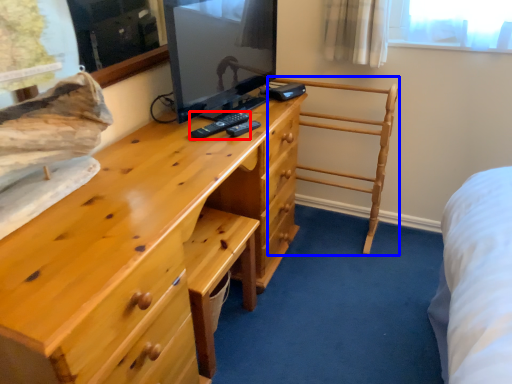
Question: Among these objects, which one is nearest to the camera, remote (highlighted by a red box) or furniture (highlighted by a blue box)?

Choices:
 (A) remote
 (B) furniture

Answer: (A)